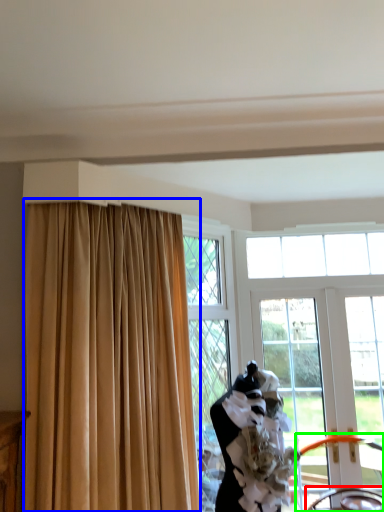
Question: Based on their relative distances, which object is farther from chair (highlighted by a red box)? Choose from curtain (highlighted by a blue box) and chair (highlighted by a green box).

Choices:
 (A) curtain
 (B) chair

Answer: (A)